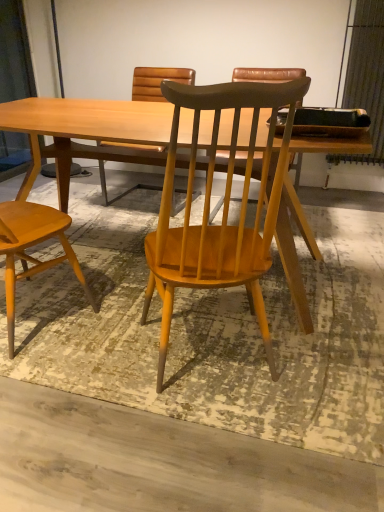
At what (x,y) coordinates should I click in order to perform the action: click on unoccupied region to the right of wooden chair at center, arranged as the second chair when viewed from the left. Please return your answer as a coordinate pair (x, y). Looking at the image, I should click on (322, 359).